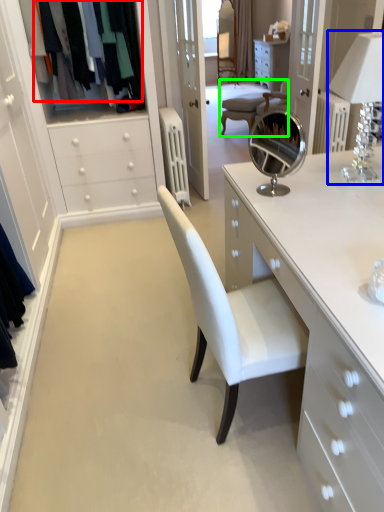
Question: Estimate the real-world distances between objects in this image. Which object is closer to clothing (highlighted by a red box), table lamp (highlighted by a blue box) or chair (highlighted by a green box)?

Choices:
 (A) table lamp
 (B) chair

Answer: (A)